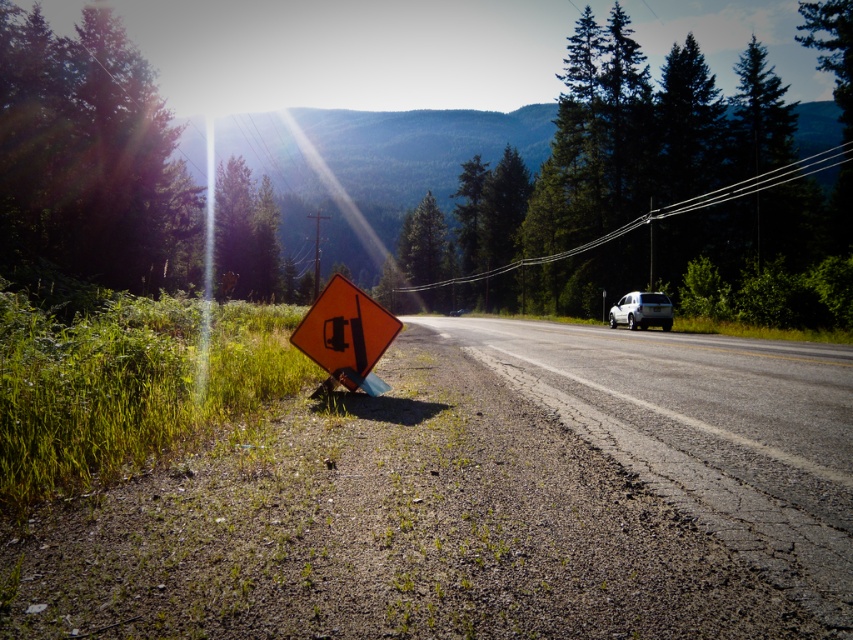
You are a pedestrian standing on the side of the road and want to cross the asphalt road at center. There is a metallic wire at upper center above the road. Can you safely cross the road without touching the metallic wire?

The asphalt road at center is positioned under metallic wire at upper center, so yes, you can safely cross the asphalt road at center without touching the metallic wire at upper center as it is above the road.